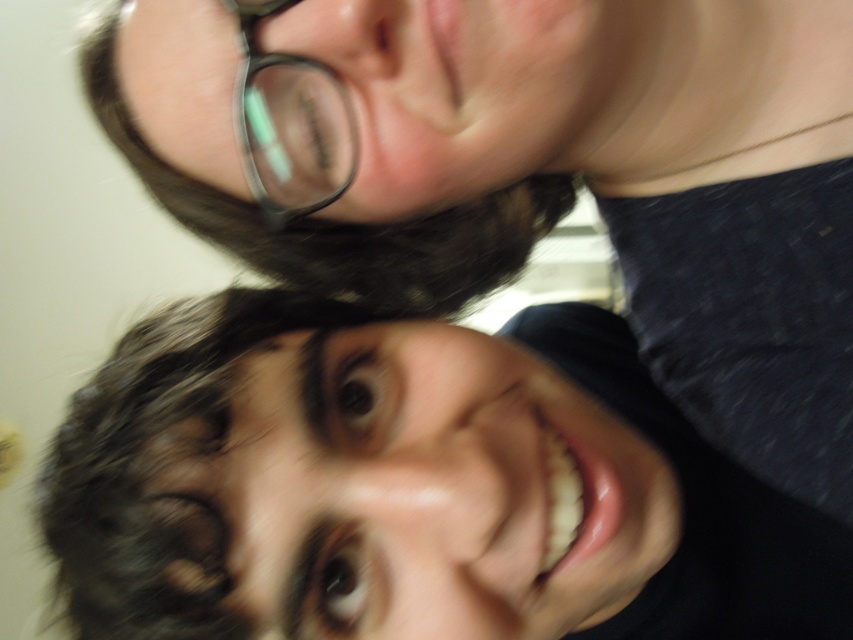
Between dark brown hair at lower left and black plastic glasses at upper center, which one is positioned higher?

black plastic glasses at upper center

Is dark brown hair at lower left above black plastic glasses at upper center?

No.

You are a GUI agent. You are given a task and a screenshot of the screen. Output one action in this format:
    pyautogui.click(x=<x>, y=<y>)
    Task: Click on the dark brown hair at lower left
    The image size is (853, 640).
    Given the screenshot: What is the action you would take?
    pyautogui.click(x=413, y=486)